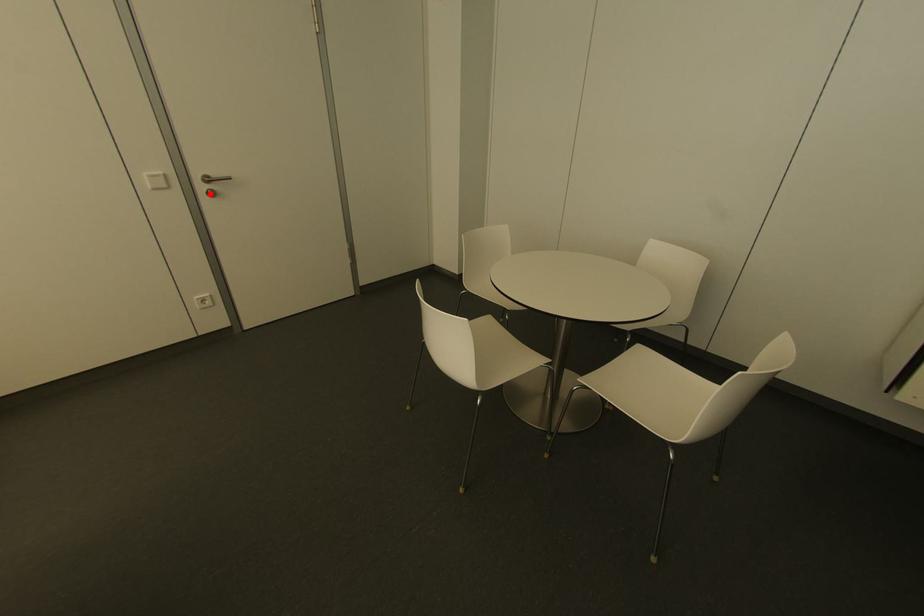
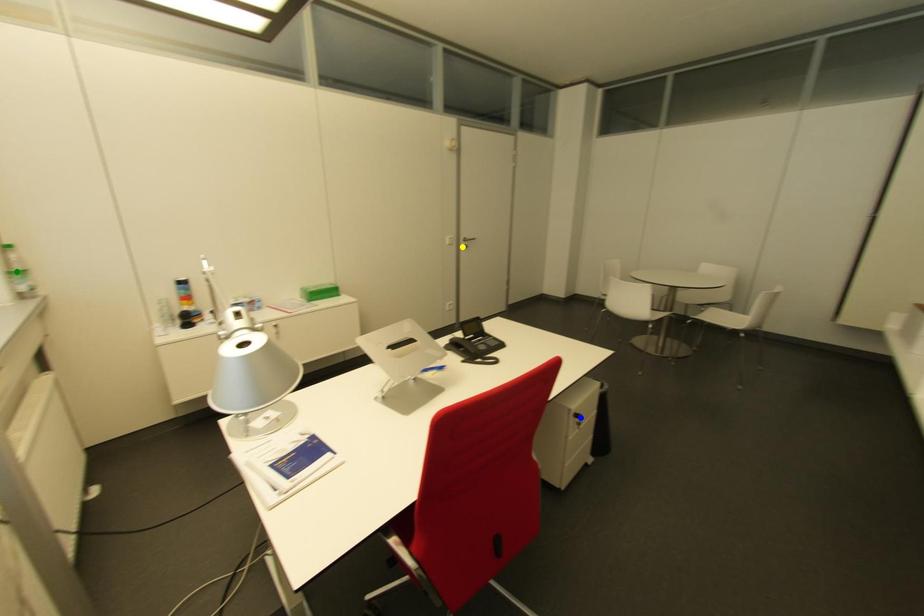
Question: I am providing you with two images of the same scene from different viewpoints. A red point is marked on the first image. You are given multiple points on the second image. Can you choose the point in image 2 that corresponds to the point in image 1?

Choices:
 (A) yellow point
 (B) blue point
 (C) green point

Answer: (A)